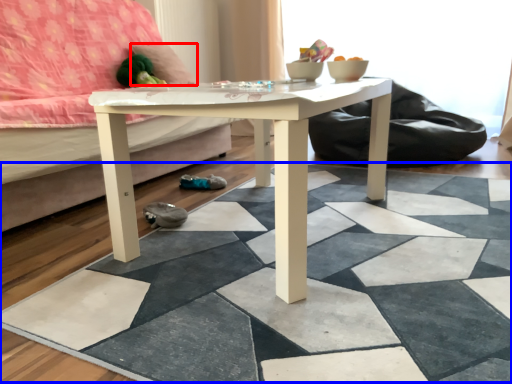
Question: Which object is closer to the camera taking this photo, pillow (highlighted by a red box) or tile (highlighted by a blue box)?

Choices:
 (A) pillow
 (B) tile

Answer: (B)